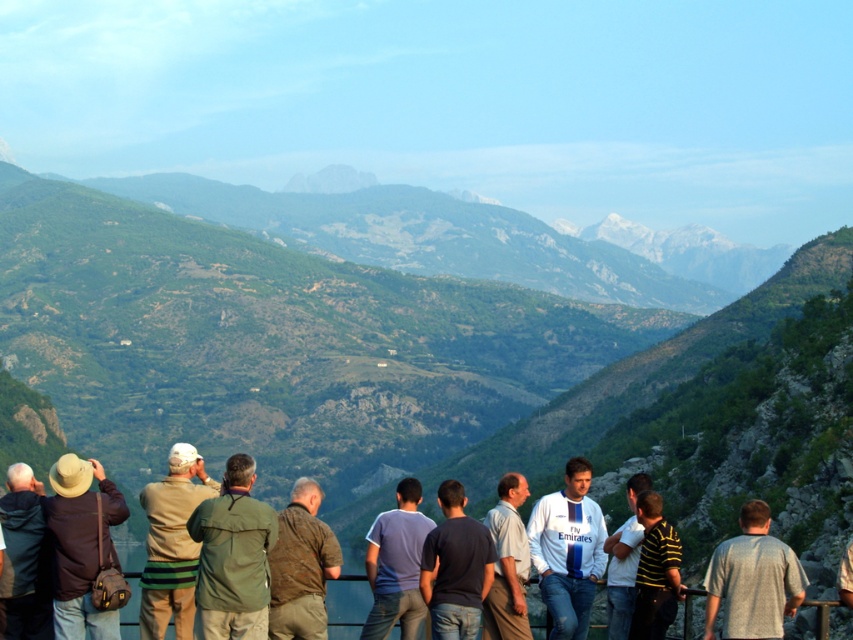
Looking at this image, you are standing at the scenic overlook and want to take a photo of the mountain view. There is a person wearing a matte brown hat at left in the foreground. If you position yourself so that the person is just out of frame to the left, will the point represented by point [80,545] still be visible in your photo?

The matte brown hat at left is represented by point [80,545]. If the person is positioned out of frame to the left, the point [80,545] would no longer be visible in the photo since it is located at the left edge of the frame.

You are standing at the scenic overlook and want to take a photo that includes both the group of people and the mountain view. If you position yourself so that the point at point [114,497] is closer to you than point [39,605], will you be able to capture both the group and the mountains in the same frame?

Yes, because point [114,497] is closer to you than point [39,605], allowing both the group of people and the mountain view to be within the frame.

You are a photographer trying to capture a photo of the mountain view. You notice two people in the foreground wearing a brown textured jacket at center and a white shirt at center. Which clothing item is less likely to block the mountain view in your photo?

The brown textured jacket at center is shorter than the white shirt at center, so the brown textured jacket at center is less likely to block the mountain view in your photo because it is shorter and may be positioned lower in the frame.